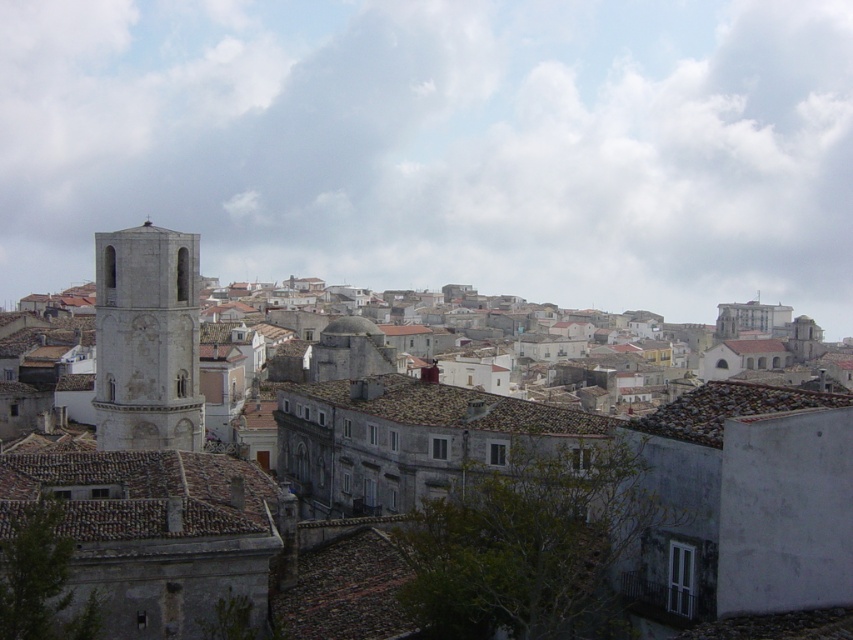
You are a city planner assessing the urban layout. Considering the gray stone bell tower at left and the brown tile roof at center, which structure has a wider base?

The brown tile roof at center has a wider base than the gray stone bell tower at left.

You are standing in the historic town and want to locate the stone tower at left. According to the map, there is a point marked at coordinates (613, 476). Where is this point located?

The point marked at coordinates (613, 476) is on the stone tower at left.

You are standing in the historic town depicted in the image. You notice two points marked on the ground. The first point is at coordinates point (796, 556), and the second is at point (589, 416). Which point is closer to you as you face the bell tower?

Point (796, 556) is in front of point (589, 416), so it is closer to you as you face the bell tower.